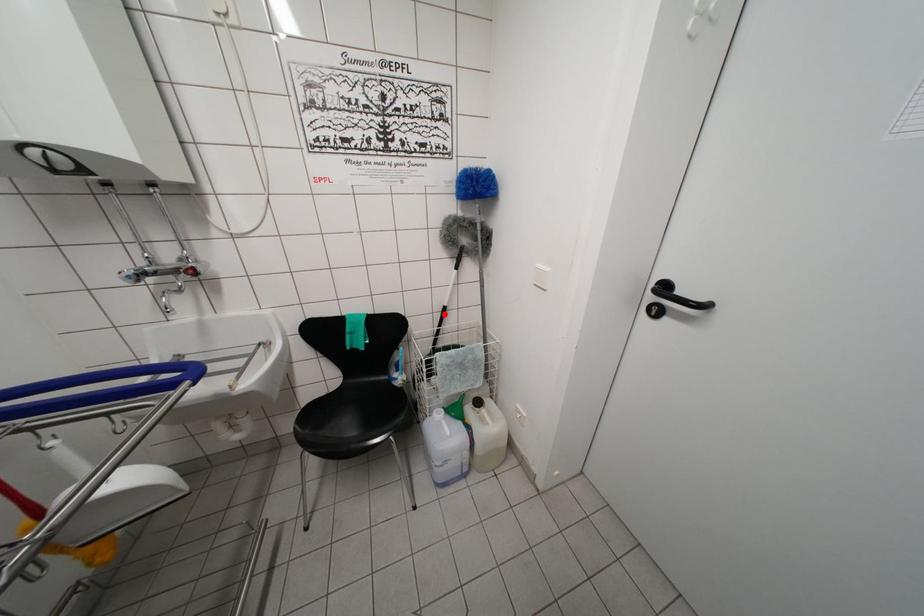
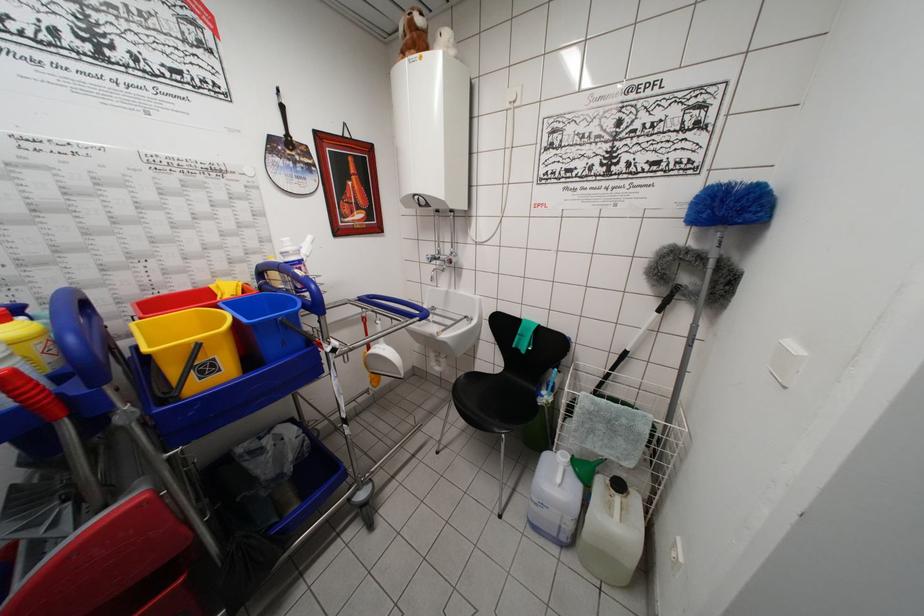
In the second image, find the point that corresponds to the highlighted location in the first image.

(624, 358)